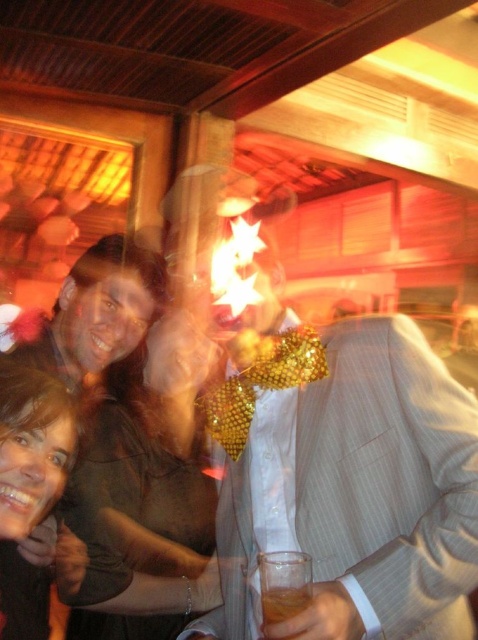
You are at a party and want to take a clear photo of the matte gold star at upper center and the matte brown hair at center. Which object should you focus on to ensure the sharpest image?

The matte gold star at upper center has a greater width than the matte brown hair at center, so focusing on the matte gold star at upper center would likely result in a sharper image due to its larger size.

You are a photographer at the event and want to capture a clear photo of the translucent amber liquid at lower center without the matte gold star at upper center blocking it. What adjustment should you make to your camera?

The matte gold star at upper center is closer to the viewer than the translucent amber liquid at lower center. To avoid the star blocking the liquid, you should adjust the camera focus to focus on the translucent amber liquid at lower center and move the camera position slightly backward to create more distance between the star and the liquid.